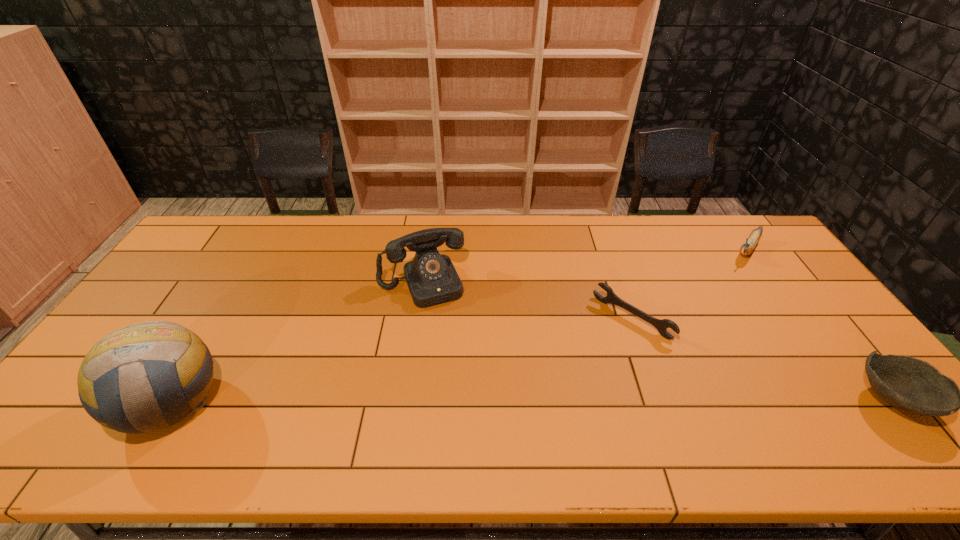
Where is `vacant area that lies between the bowl and the wrench`? This screenshot has width=960, height=540. vacant area that lies between the bowl and the wrench is located at coordinates (762, 359).

Find the location of `unoccupied area between the bowl and the banana`. unoccupied area between the bowl and the banana is located at coordinates (820, 325).

Identify the location of unoccupied position between the telephone and the tallest object. Image resolution: width=960 pixels, height=540 pixels. (297, 343).

Locate an element on the screen. The image size is (960, 540). object that ranks as the third closest to the volleyball is located at coordinates (749, 245).

Identify the location of the second closest object to the wrench. (432, 279).

Where is `free space that satisfies the following two spatial constraints: 1. on the back side of the third object from left to right; 2. on the right side of the banana`? The width and height of the screenshot is (960, 540). free space that satisfies the following two spatial constraints: 1. on the back side of the third object from left to right; 2. on the right side of the banana is located at coordinates (608, 249).

Find the location of a particular element. The image size is (960, 540). free space in the image that satisfies the following two spatial constraints: 1. on the back side of the fourth tallest object; 2. on the left side of the tallest object is located at coordinates (173, 400).

The width and height of the screenshot is (960, 540). In order to click on free region that satisfies the following two spatial constraints: 1. on the back side of the banana; 2. on the right side of the leftmost object in this screenshot , I will do `click(261, 249)`.

The width and height of the screenshot is (960, 540). Find the location of `blank area in the image that satisfies the following two spatial constraints: 1. on the back side of the second object from left to right; 2. on the left side of the volleyball`. blank area in the image that satisfies the following two spatial constraints: 1. on the back side of the second object from left to right; 2. on the left side of the volleyball is located at coordinates (241, 283).

I want to click on vacant space that satisfies the following two spatial constraints: 1. on the back side of the tallest object; 2. on the right side of the telephone, so click(x=241, y=283).